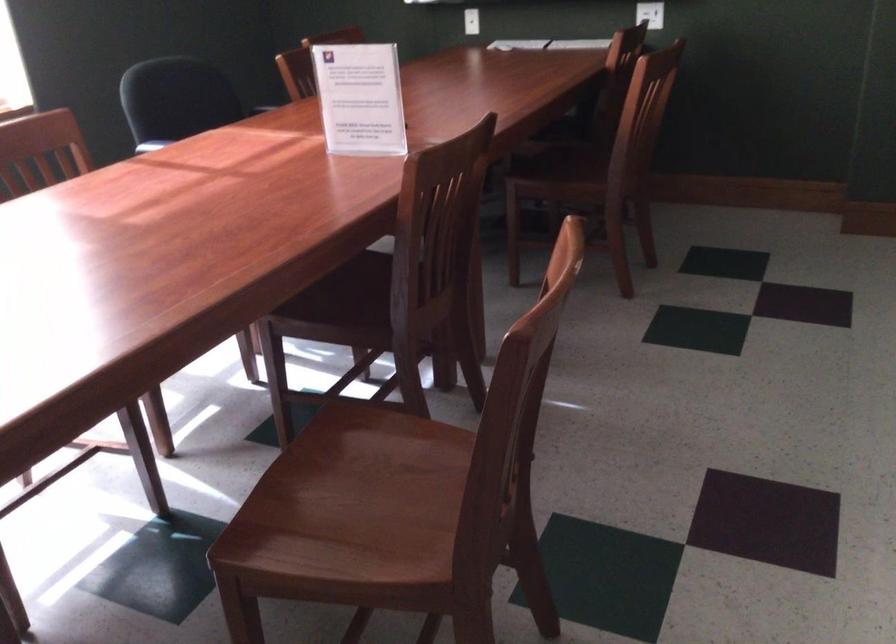
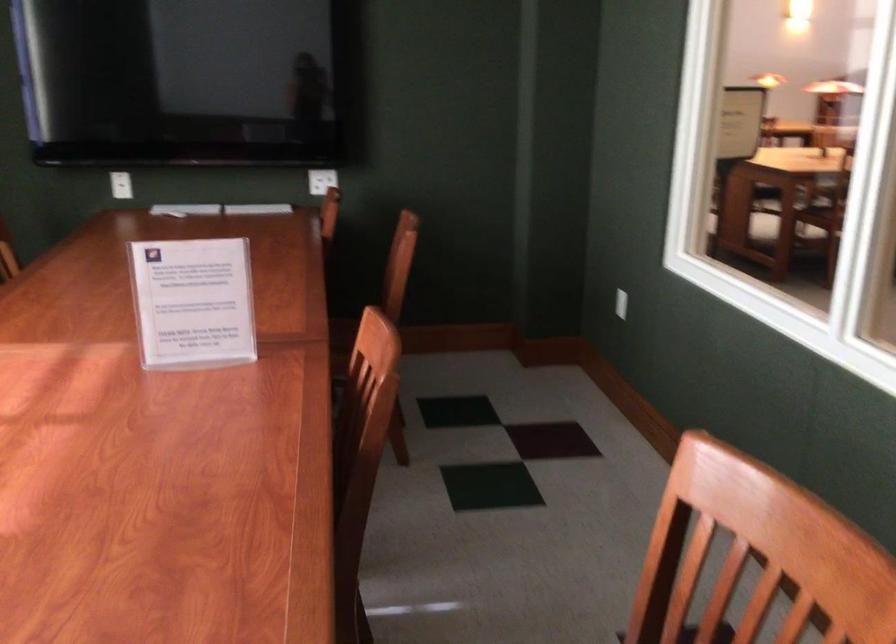
Question: I am providing you with two images of the same scene from different viewpoints. Please identify which objects are invisible in image2.

Choices:
 (A) acrylic sign holder
 (B) wooden chair sitting surface
 (C) white light switch
 (D) green power tool

Answer: (B)